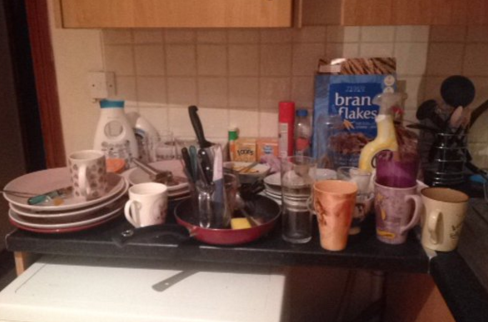
Find the location of a particular element. This screenshot has height=322, width=488. measuring cup is located at coordinates (199, 206).